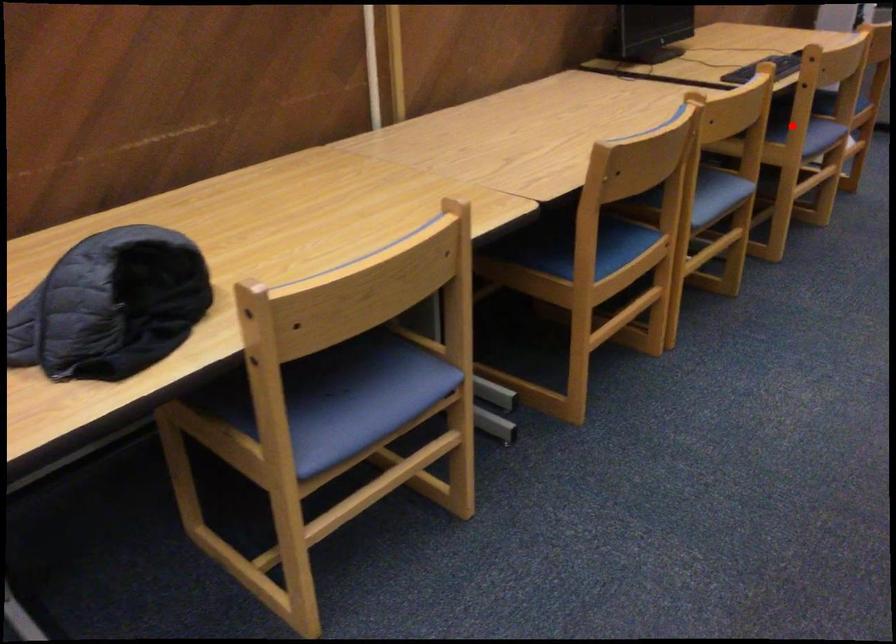
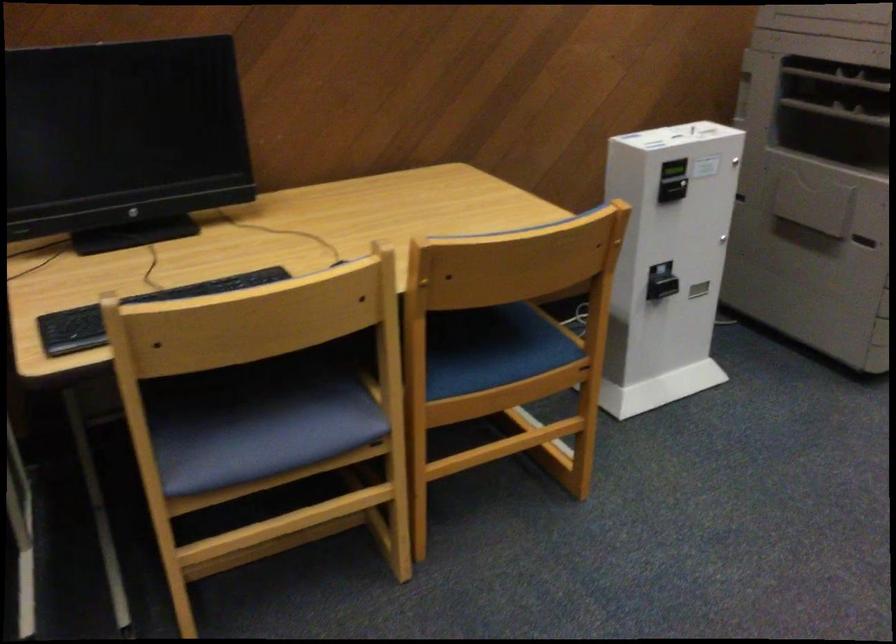
Question: I am providing you with two images of the same scene from different viewpoints. In image1, a red point is highlighted. Considering the same 3D point in image2, which of the following is correct?

Choices:
 (A) It is closer
 (B) It is farther

Answer: (A)